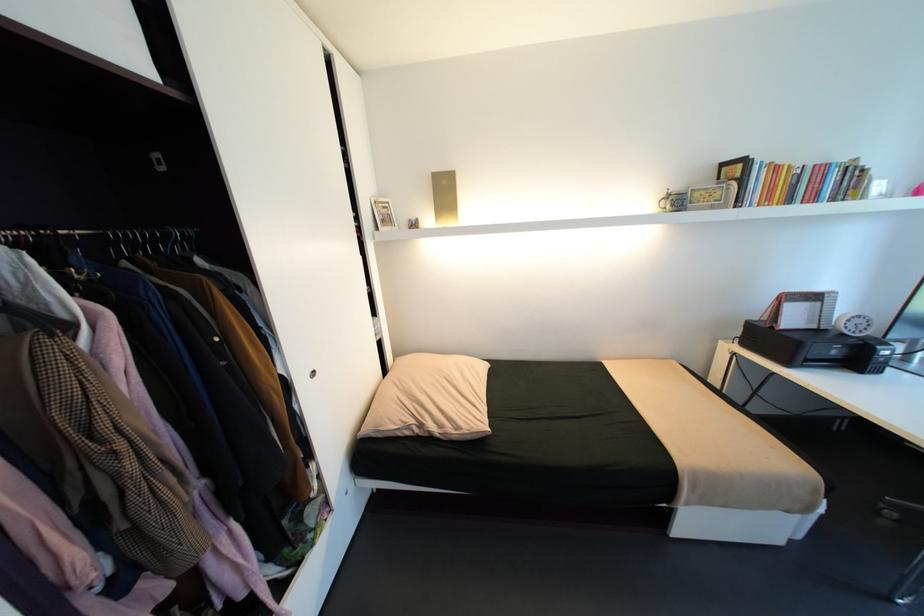
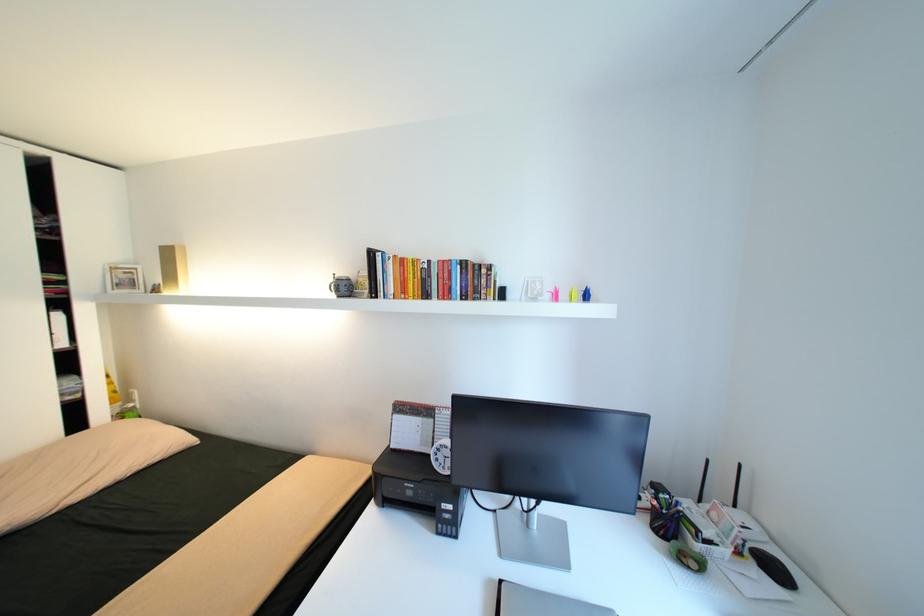
Question: In a continuous first-person perspective shot, in which direction is the camera moving?

Choices:
 (A) Left
 (B) Right
 (C) Forward
 (D) Backward

Answer: (B)